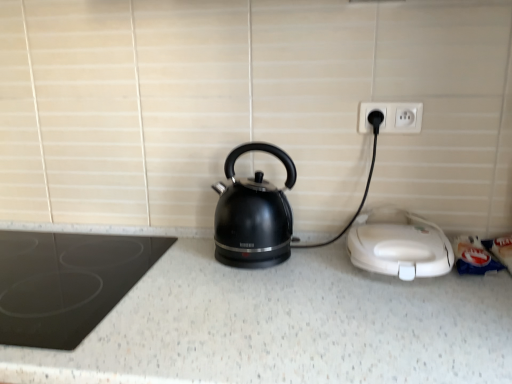
The image size is (512, 384). I want to click on free location in front of black glossy kettle at center, so 246,291.